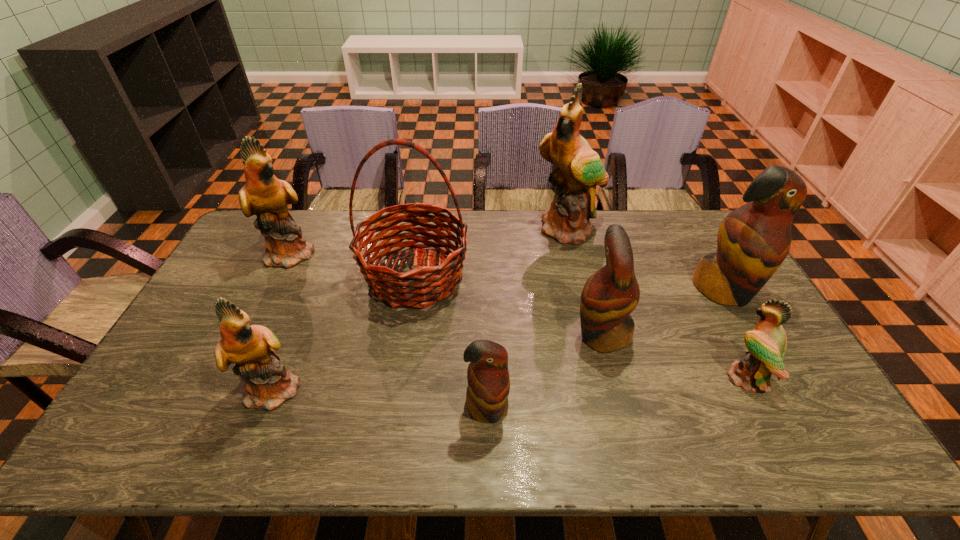
At what (x,y) coordinates should I click in order to perform the action: click on the tallest parrot. Please return your answer as a coordinate pair (x, y). Looking at the image, I should click on (580, 169).

Identify the location of the second green parrot from right to left. (580, 169).

Where is `basket`? This screenshot has height=540, width=960. basket is located at coordinates (421, 287).

The image size is (960, 540). I want to click on the third smallest green parrot, so click(264, 195).

Locate an element on the screen. This screenshot has height=540, width=960. the farthest red parrot is located at coordinates (753, 240).

The width and height of the screenshot is (960, 540). What are the coordinates of `the rightmost red parrot` in the screenshot? It's located at (753, 240).

Where is `the second red parrot from right to left`? Image resolution: width=960 pixels, height=540 pixels. the second red parrot from right to left is located at coordinates (609, 296).

Find the location of a particular element. Image resolution: width=960 pixels, height=540 pixels. the second biggest red parrot is located at coordinates pos(609,296).

Locate an element on the screen. This screenshot has width=960, height=540. the second smallest green parrot is located at coordinates (268, 383).

You are a GUI agent. You are given a task and a screenshot of the screen. Output one action in this format:
    pyautogui.click(x=<x>, y=<y>)
    Task: Click on the rightmost green parrot
    
    Given the screenshot: What is the action you would take?
    pyautogui.click(x=767, y=343)